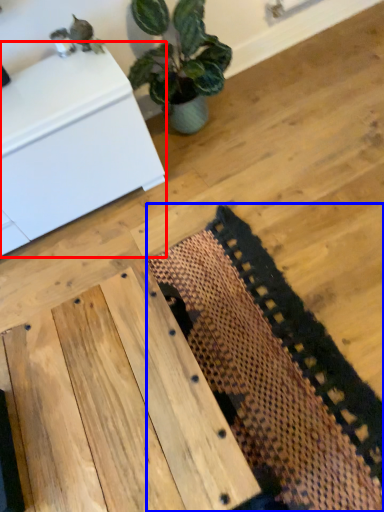
Question: Which point is further to the camera, furniture (highlighted by a red box) or mat (highlighted by a blue box)?

Choices:
 (A) furniture
 (B) mat

Answer: (A)